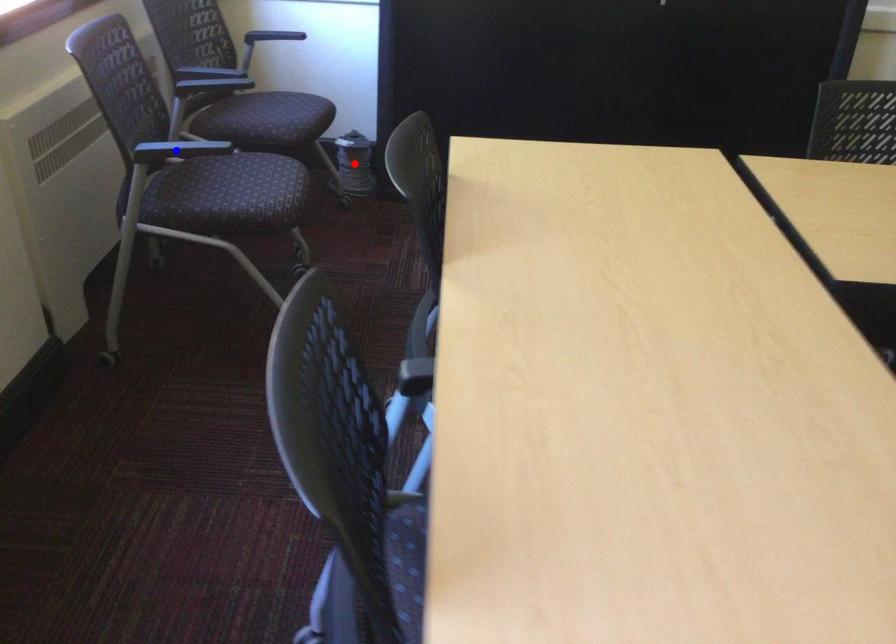
Question: Two points are marked on the image. Which point is closer to the camera?

Choices:
 (A) Blue point is closer.
 (B) Red point is closer.

Answer: (A)